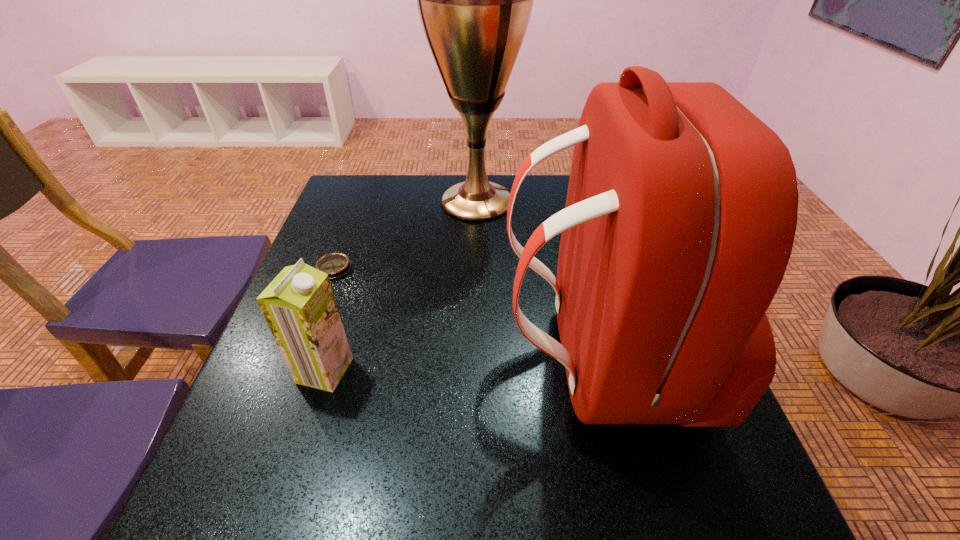
This screenshot has height=540, width=960. I want to click on free point located on the back of the shortest object, so click(362, 192).

Identify the location of object located in the far edge section of the desktop. (475, 0).

This screenshot has width=960, height=540. In order to click on soya milk present at the left edge in this screenshot , I will do `click(299, 306)`.

I want to click on compass at the left edge, so click(x=336, y=265).

Find the location of a particular element. object that is at the right edge is located at coordinates (681, 211).

At what (x,y) coordinates should I click in order to perform the action: click on free location at the far edge. Please return your answer as a coordinate pair (x, y). Looking at the image, I should click on (492, 178).

In order to click on vacant area at the near edge of the desktop in this screenshot , I will do `click(321, 483)`.

Image resolution: width=960 pixels, height=540 pixels. What are the coordinates of `vacant space at the left edge of the desktop` in the screenshot? It's located at (317, 260).

This screenshot has width=960, height=540. In order to click on vacant area at the far left corner of the desktop in this screenshot , I will do `click(363, 192)`.

Find the location of a particular element. This screenshot has height=540, width=960. free space between the shortest object and the trophy cup is located at coordinates (405, 235).